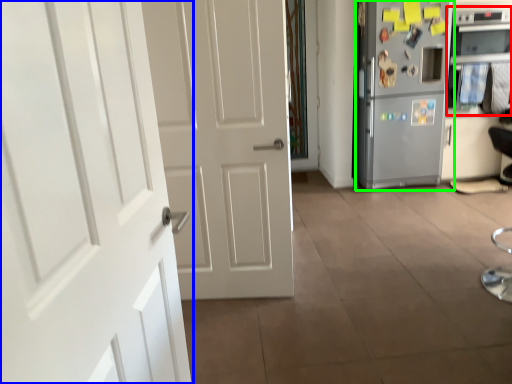
Question: Estimate the real-world distances between objects in this image. Which object is farther from oven (highlighted by a red box), door (highlighted by a blue box) or refrigerator (highlighted by a green box)?

Choices:
 (A) door
 (B) refrigerator

Answer: (A)